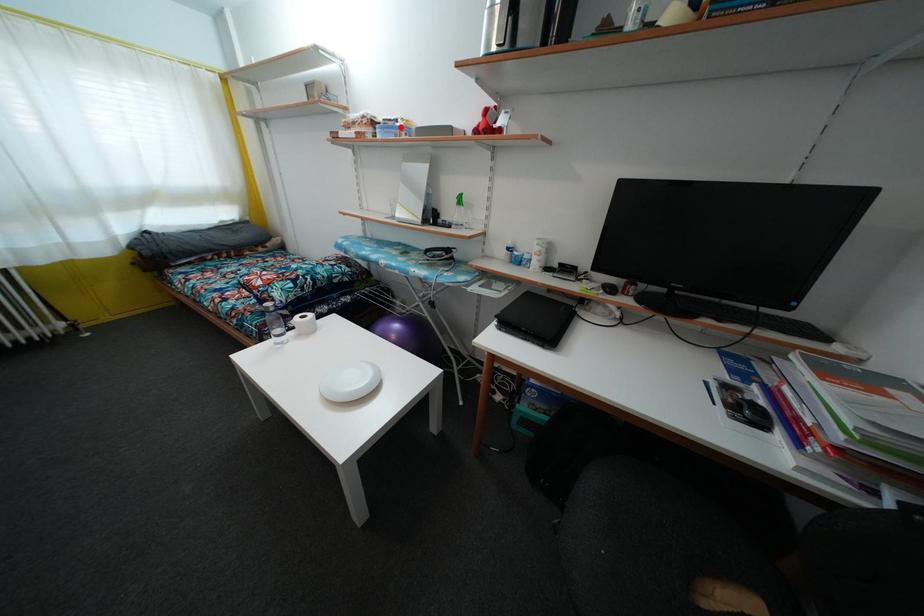
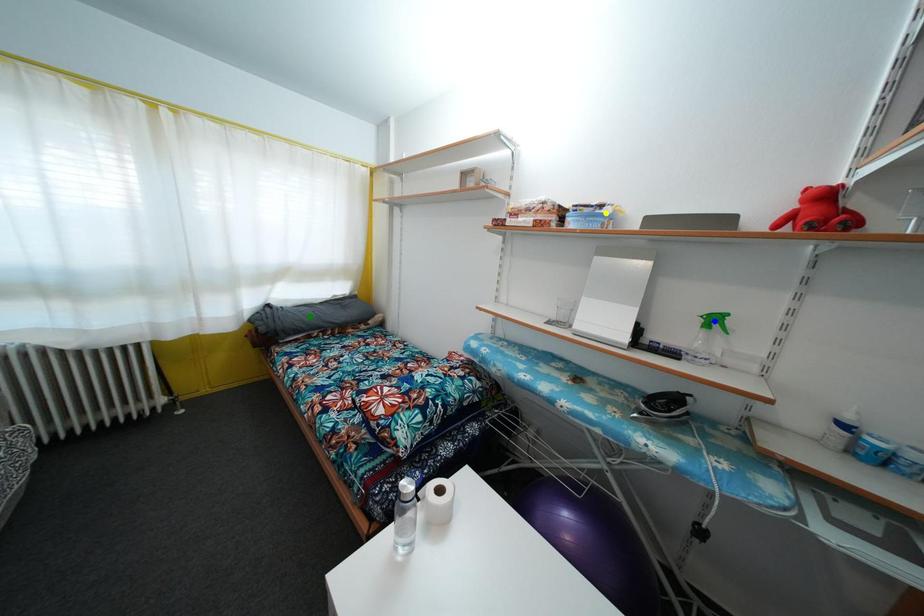
Question: I am providing you with two images of the same scene from different viewpoints. A red point is marked on the first image. You are given multiple points on the second image. Which spot in image 2 lines up with the point in image 1?

Choices:
 (A) green point
 (B) blue point
 (C) yellow point

Answer: (C)